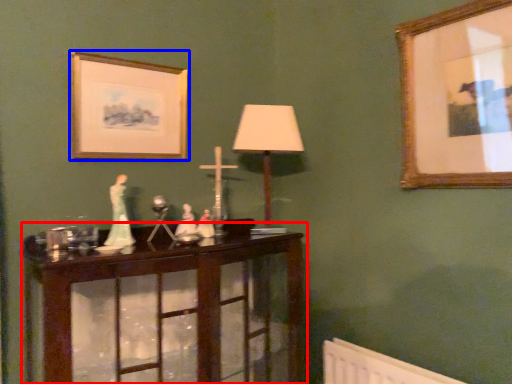
Question: Which of the following is the closest to the observer, table (highlighted by a red box) or picture frame (highlighted by a blue box)?

Choices:
 (A) table
 (B) picture frame

Answer: (A)